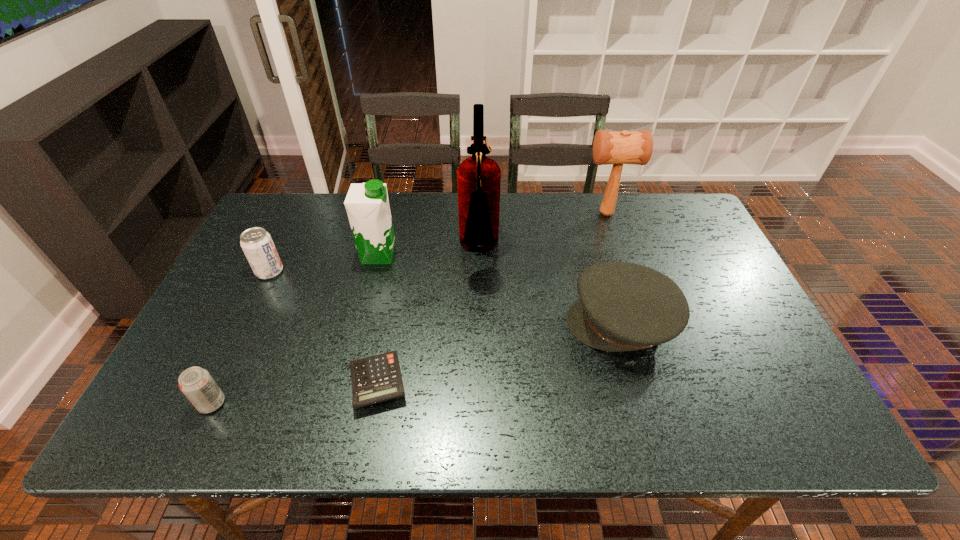
I want to click on fire extinguisher that is at the far edge, so click(x=478, y=177).

Find the location of a particular element. mallet that is positioned at the far edge is located at coordinates (609, 147).

Where is `soda can present at the near edge`? The image size is (960, 540). soda can present at the near edge is located at coordinates (196, 383).

The image size is (960, 540). In order to click on calculator located in the near edge section of the desktop in this screenshot , I will do `click(377, 378)`.

At what (x,y) coordinates should I click in order to perform the action: click on object that is positioned at the near left corner. Please return your answer as a coordinate pair (x, y). This screenshot has height=540, width=960. Looking at the image, I should click on (196, 383).

I want to click on vacant area at the far edge of the desktop, so click(x=458, y=206).

In the image, there is a desktop. Identify the location of vacant space at the near edge. The height and width of the screenshot is (540, 960). (408, 409).

The height and width of the screenshot is (540, 960). In the image, there is a desktop. Find the location of `vacant space at the right edge`. vacant space at the right edge is located at coordinates (701, 298).

You are a GUI agent. You are given a task and a screenshot of the screen. Output one action in this format:
    pyautogui.click(x=<x>, y=<y>)
    Task: Click on the free space at the far left corner of the desktop
    The image size is (960, 540).
    Given the screenshot: What is the action you would take?
    click(290, 193)

Locate an element on the screen. The width and height of the screenshot is (960, 540). free spot between the mallet and the third object from right to left is located at coordinates (542, 232).